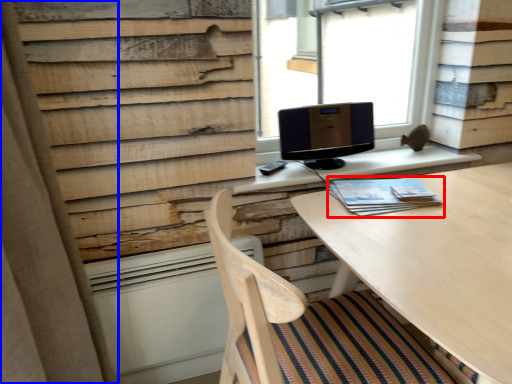
Question: Among these objects, which one is farthest to the camera, book (highlighted by a red box) or curtain (highlighted by a blue box)?

Choices:
 (A) book
 (B) curtain

Answer: (A)